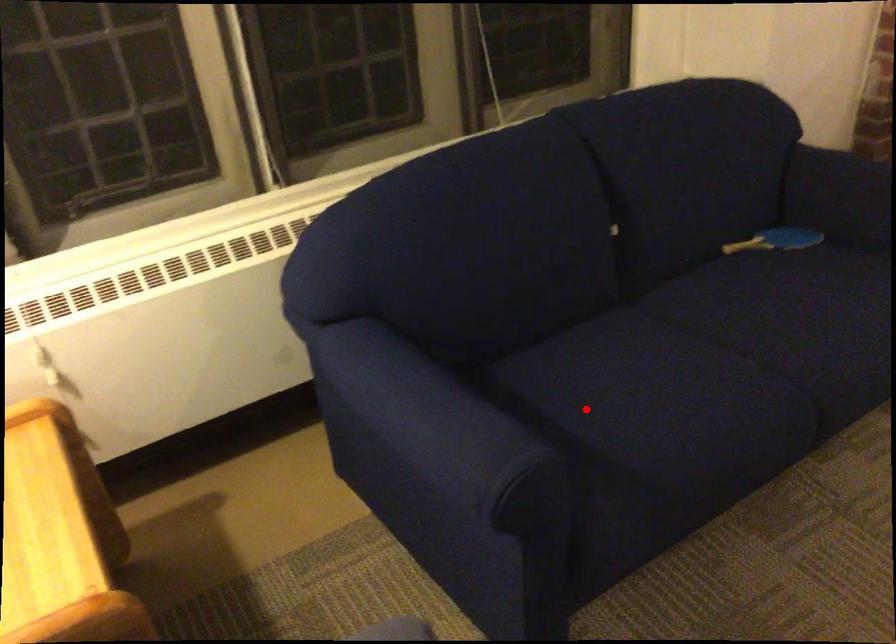
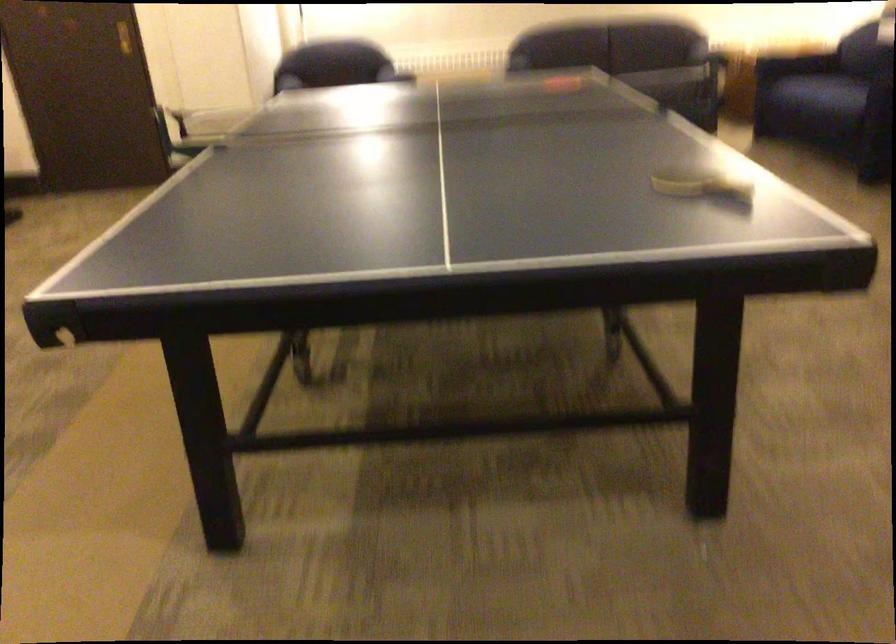
Question: I am providing you with two images of the same scene from different viewpoints. A red point is shown in image1. For the corresponding object point in image2, is it positioned nearer or farther from the camera?

Choices:
 (A) Nearer
 (B) Farther

Answer: (B)